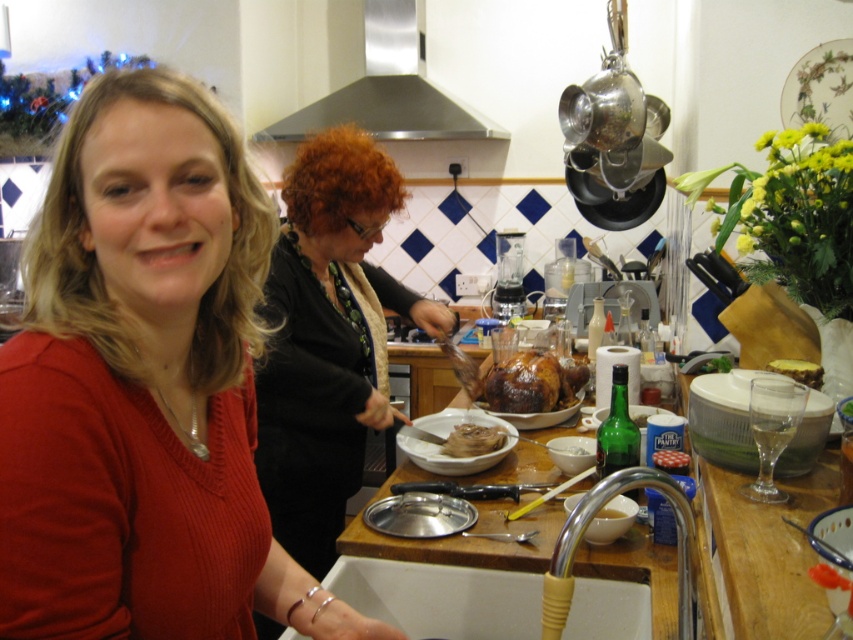
Question: Is black fabric sweater at center behind white ceramic sink at lower center?

Choices:
 (A) no
 (B) yes

Answer: (B)

Question: Is matte red sweater at center further to camera compared to brown matte food at center?

Choices:
 (A) yes
 (B) no

Answer: (B)

Question: Which of the following is the farthest from the observer?

Choices:
 (A) black fabric sweater at center
 (B) brown matte food at center

Answer: (B)

Question: Which of the following is the closest to the observer?

Choices:
 (A) black fabric sweater at center
 (B) matte red sweater at center
 (C) brown crispy turkey at center
 (D) stainless steel exhaust hood at upper center

Answer: (B)

Question: Can you confirm if black fabric sweater at center is wider than stainless steel exhaust hood at upper center?

Choices:
 (A) yes
 (B) no

Answer: (B)

Question: Which object is farther from the camera taking this photo?

Choices:
 (A) stainless steel exhaust hood at upper center
 (B) white ceramic sink at lower center
 (C) brown crispy turkey at center

Answer: (A)